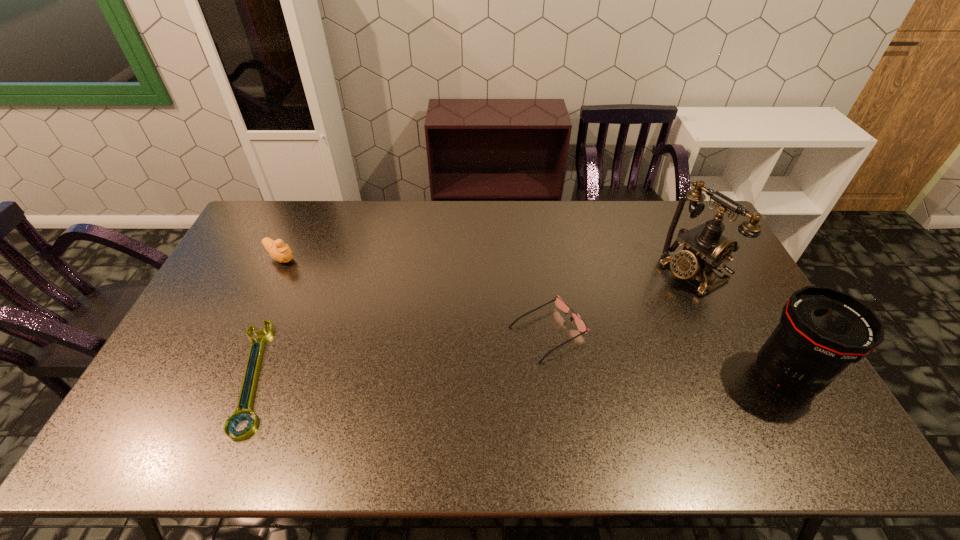
Locate an element on the screen. This screenshot has width=960, height=540. free spot that satisfies the following two spatial constraints: 1. on the front side of the third shortest object; 2. on the left side of the tallest object is located at coordinates (274, 273).

The height and width of the screenshot is (540, 960). Find the location of `vacant position in the image that satisfies the following two spatial constraints: 1. on the front side of the duckling; 2. on the right side of the telephone`. vacant position in the image that satisfies the following two spatial constraints: 1. on the front side of the duckling; 2. on the right side of the telephone is located at coordinates 274,273.

You are a GUI agent. You are given a task and a screenshot of the screen. Output one action in this format:
    pyautogui.click(x=<x>, y=<y>)
    Task: Click on the free space in the image that satisfies the following two spatial constraints: 1. on the front side of the fourth shortest object; 2. on the left side of the sunglasses
    The width and height of the screenshot is (960, 540).
    Given the screenshot: What is the action you would take?
    pyautogui.click(x=555, y=377)

At what (x,y) coordinates should I click in order to perform the action: click on free spot that satisfies the following two spatial constraints: 1. on the back side of the tallest object; 2. on the left side of the third object from right to left. Please return your answer as a coordinate pair (x, y). The image size is (960, 540). Looking at the image, I should click on (540, 273).